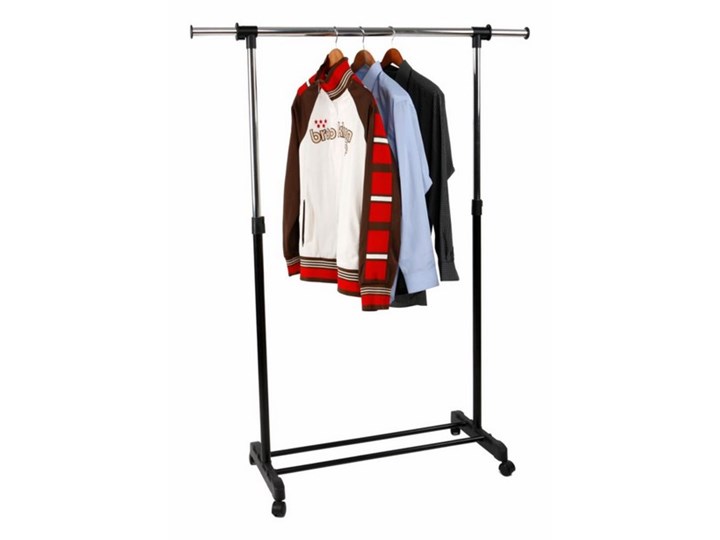
Image resolution: width=720 pixels, height=540 pixels. I want to click on clothes hanger, so click(x=341, y=58), click(x=366, y=58), click(x=390, y=57), click(x=391, y=33), click(x=361, y=39), click(x=338, y=39).